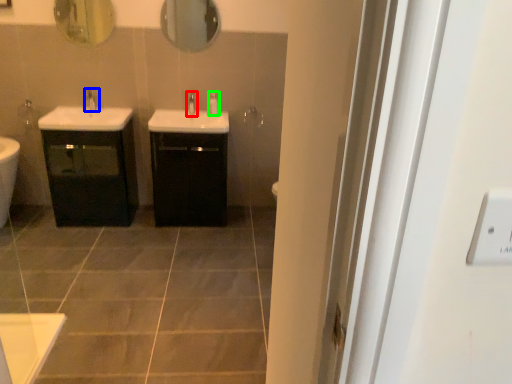
Question: Considering the real-world distances, which object is farthest from tap (highlighted by a red box)? tap (highlighted by a blue box) or soap dispenser (highlighted by a green box)?

Choices:
 (A) tap
 (B) soap dispenser

Answer: (A)